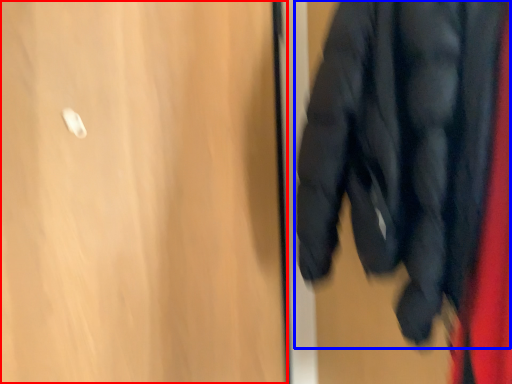
Question: Which of the following is the closest to the observer, door (highlighted by a red box) or jacket (highlighted by a blue box)?

Choices:
 (A) door
 (B) jacket

Answer: (B)